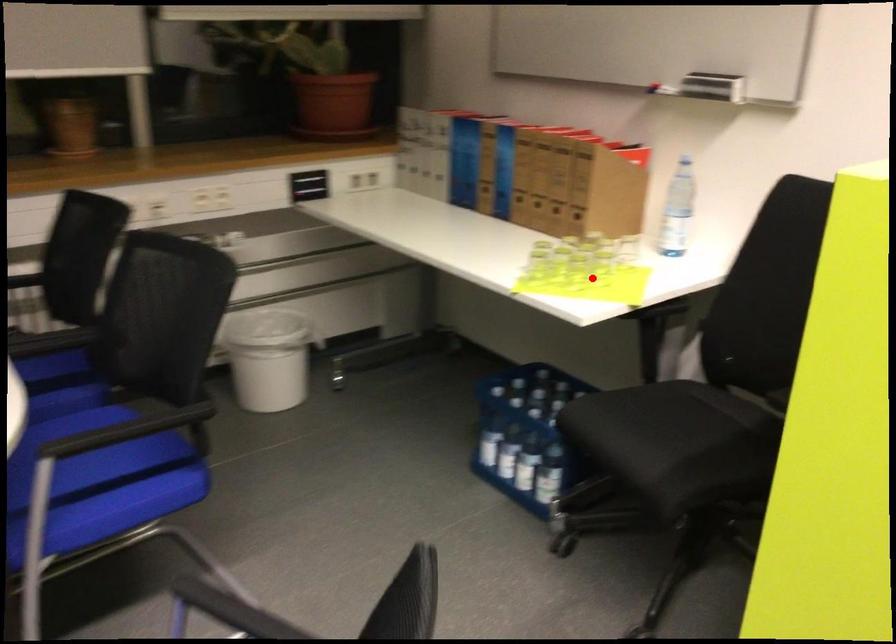
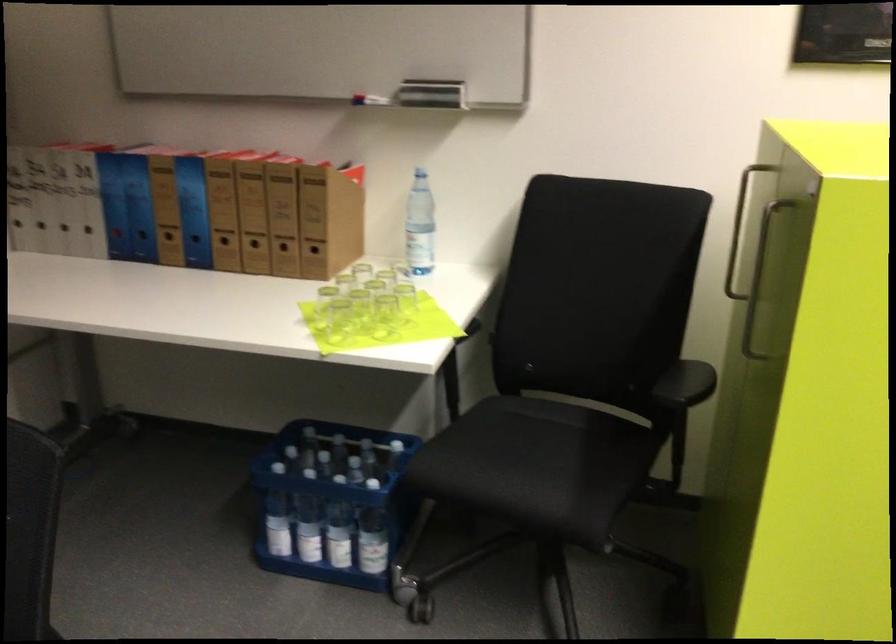
Question: I am providing you with two images of the same scene from different viewpoints. Image1 has a red point marked. In image2, the corresponding 3D location appears at what relative position? Reply with the corresponding letter.

Choices:
 (A) Closer
 (B) Farther

Answer: (A)